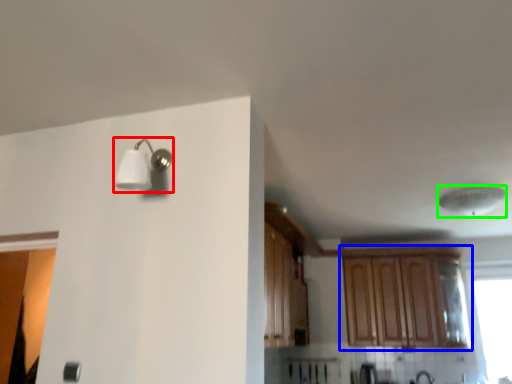
Question: Based on their relative distances, which object is farther from light fixture (highlighted by a red box)? Choose from cabinetry (highlighted by a blue box) and lamp (highlighted by a green box).

Choices:
 (A) cabinetry
 (B) lamp

Answer: (A)